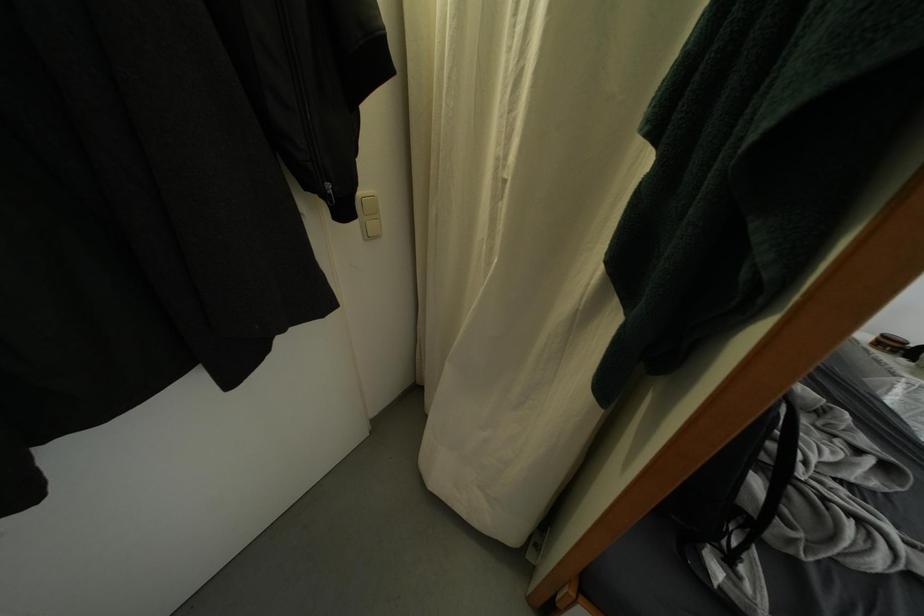
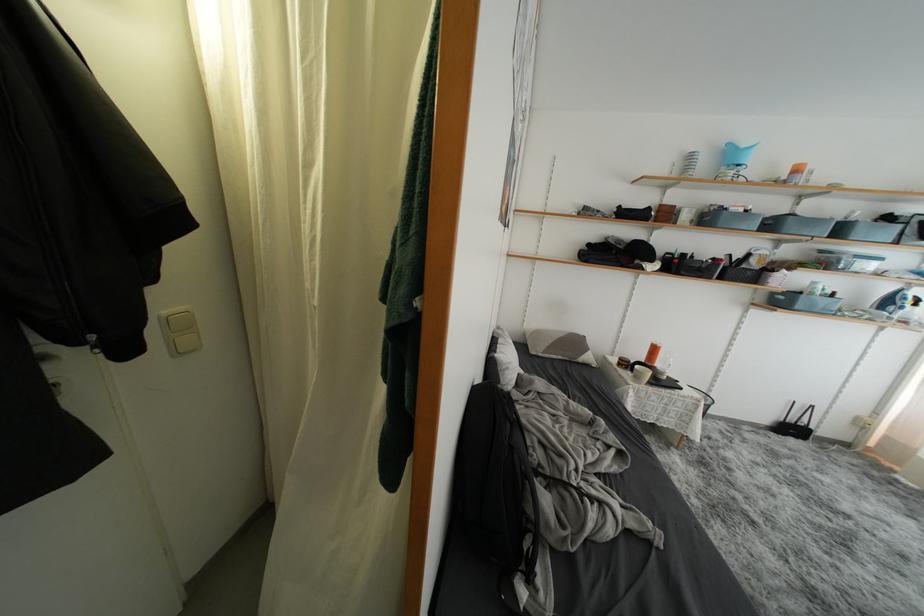
Which direction would the cameraman need to move to produce the second image?

The movement direction of the cameraman is right, backward.